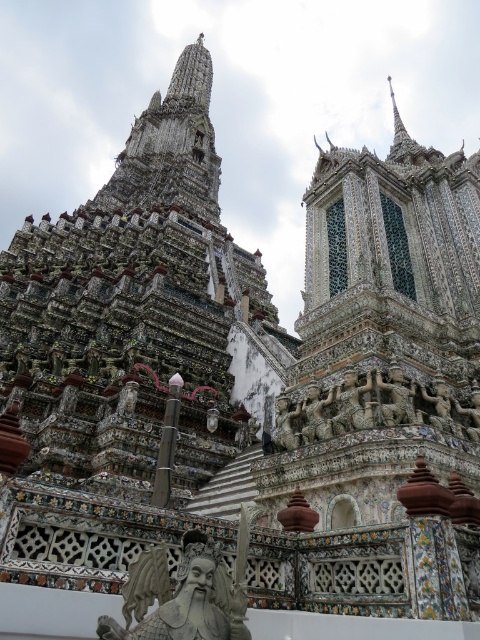
Question: Among these objects, which one is nearest to the camera?

Choices:
 (A) gray stone statue at lower center
 (B) carved stone figures at center

Answer: (A)

Question: Is gray stone statue at lower center behind carved stone figures at center?

Choices:
 (A) yes
 (B) no

Answer: (B)

Question: Does gray stone statue at lower center appear over carved stone figures at center?

Choices:
 (A) no
 (B) yes

Answer: (A)

Question: Can you confirm if gray stone statue at lower center is positioned to the right of carved stone figures at center?

Choices:
 (A) yes
 (B) no

Answer: (B)

Question: Which point is farther to the camera?

Choices:
 (A) gray stone statue at lower center
 (B) carved stone figures at center

Answer: (B)